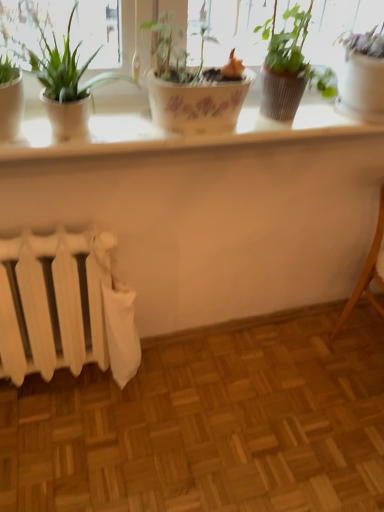
Identify the location of blank space situated above white glossy counter top at upper center (from a real-world perspective). Image resolution: width=384 pixels, height=512 pixels. [221, 124].